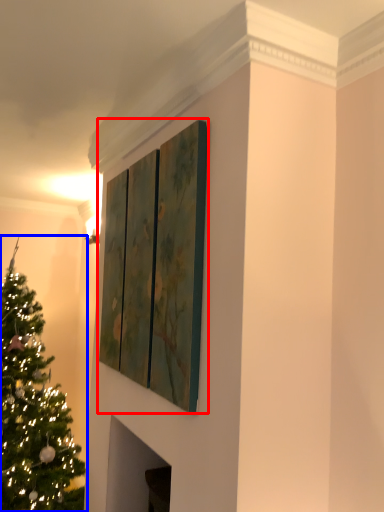
Question: Which object appears farthest to the camera in this image, window (highlighted by a red box) or christmas tree (highlighted by a blue box)?

Choices:
 (A) window
 (B) christmas tree

Answer: (B)